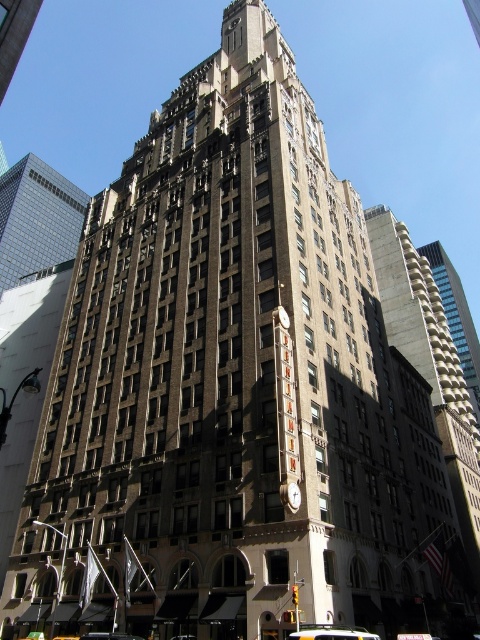
You are a delivery person trying to park your yellow rubber taxi at center in front of the brick building at center. The parking space is only wide enough for the taxi. Can you safely park your vehicle without overhanging the building?

The brick building at center is wider than the yellow rubber taxi at center. Since the parking space is only wide enough for the taxi, you can safely park without overhanging the building because the taxi is narrower than the building.

You are standing in front of the historic building and want to take a photo that includes both the glassy reflective skyscraper at upper left and the metallic clock at center. Which object should be positioned to the left in your photo?

The glassy reflective skyscraper at upper left should be positioned to the left of the metallic clock at center in your photo, as it is located to the left of the metallic clock at center according to the description.

What is the exact coordinate location of the glassy reflective skyscraper at upper left in the image?

The glassy reflective skyscraper at upper left is located at point (x=36, y=220).